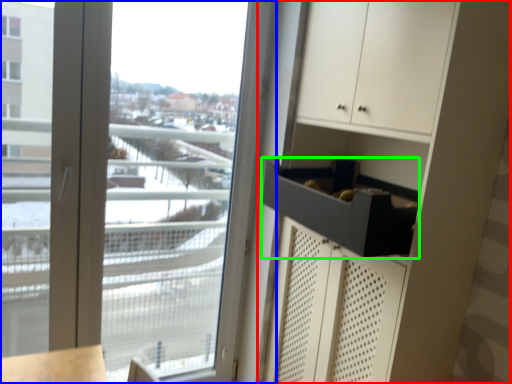
Question: Which object is positioned farthest from dresser (highlighted by a red box)? Select from window (highlighted by a blue box) and drawer (highlighted by a green box).

Choices:
 (A) window
 (B) drawer

Answer: (A)